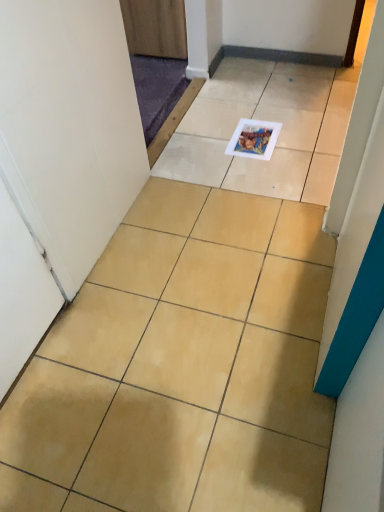
Question: Is wooden door at upper center far from beige ceramic tile at center?

Choices:
 (A) yes
 (B) no

Answer: (A)

Question: From a real-world perspective, is wooden door at upper center below beige ceramic tile at center?

Choices:
 (A) yes
 (B) no

Answer: (B)

Question: Does wooden door at upper center have a smaller size compared to beige ceramic tile at center?

Choices:
 (A) yes
 (B) no

Answer: (B)

Question: Considering the relative positions of wooden door at upper center and beige ceramic tile at center in the image provided, is wooden door at upper center to the right of beige ceramic tile at center from the viewer's perspective?

Choices:
 (A) no
 (B) yes

Answer: (A)

Question: Considering the relative sizes of wooden door at upper center and beige ceramic tile at center in the image provided, is wooden door at upper center bigger than beige ceramic tile at center?

Choices:
 (A) yes
 (B) no

Answer: (A)

Question: From the image's perspective, is wooden door at upper center located above or below beige ceramic tile at center?

Choices:
 (A) below
 (B) above

Answer: (B)

Question: Considering the positions of point (180, 24) and point (72, 448), is point (180, 24) closer or farther from the camera than point (72, 448)?

Choices:
 (A) closer
 (B) farther

Answer: (B)

Question: In the image, is wooden door at upper center positioned in front of or behind beige ceramic tile at center?

Choices:
 (A) front
 (B) behind

Answer: (B)

Question: In terms of height, does wooden door at upper center look taller or shorter compared to beige ceramic tile at center?

Choices:
 (A) tall
 (B) short

Answer: (A)

Question: Do you think matte plastic magazine at center is within beige ceramic tile at center, or outside of it?

Choices:
 (A) inside
 (B) outside

Answer: (A)

Question: Considering the positions of matte plastic magazine at center and beige ceramic tile at center in the image, is matte plastic magazine at center bigger or smaller than beige ceramic tile at center?

Choices:
 (A) big
 (B) small

Answer: (B)

Question: Does point (278, 129) appear closer or farther from the camera than point (278, 212)?

Choices:
 (A) farther
 (B) closer

Answer: (A)

Question: Relative to beige ceramic tile at center, is matte plastic magazine at center in front or behind?

Choices:
 (A) behind
 (B) front

Answer: (A)

Question: Looking at the image, does wooden door at upper center seem bigger or smaller compared to matte plastic magazine at center?

Choices:
 (A) small
 (B) big

Answer: (B)

Question: Considering the positions of point click(x=150, y=39) and point click(x=253, y=146), is point click(x=150, y=39) closer or farther from the camera than point click(x=253, y=146)?

Choices:
 (A) closer
 (B) farther

Answer: (B)